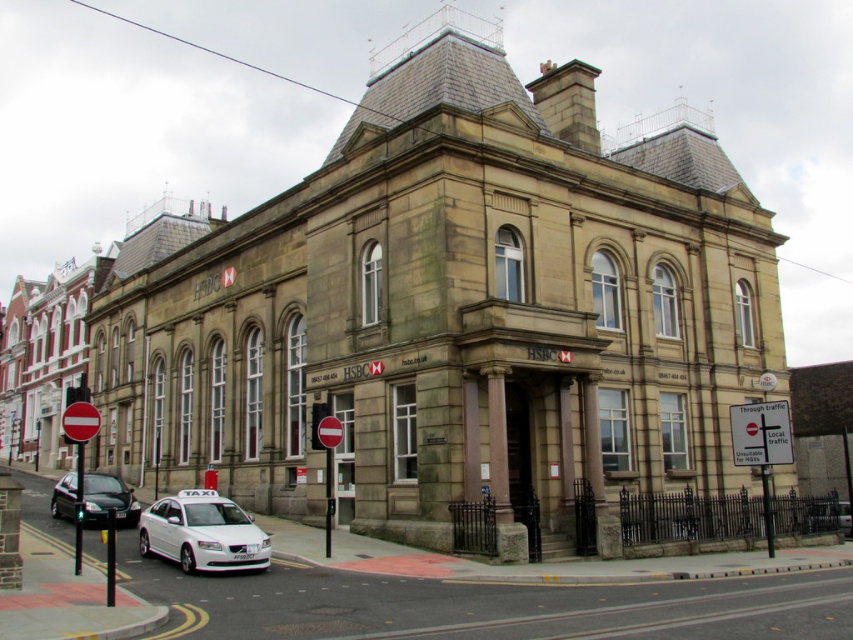
You are a delivery person who needs to park a 2.5 meter wide delivery van. You see the white glossy taxi at center and the white plastic sign at lower right. Is there enough space between them to park your van?

The white glossy taxi at center might be wider than white plastic sign at lower right, so it is uncertain if there is enough space to park the 2.5 meter wide delivery van between them.

You are standing at the entrance of the historic building and want to hail a ride. The white plastic sign at lower right indicates the nearest taxi stand. Can you walk directly to the white glossy taxi at center without crossing any obstacles?

The white glossy taxi at center is 32.10 meters away from the white plastic sign at lower right. Since the white plastic sign at lower right marks the taxi stand location, the taxi is parked away from it. However, the scene description mentions the taxi is on the street facing the camera, so there are no obstacles between you and the taxi. You can walk directly to the white glossy taxi at center.